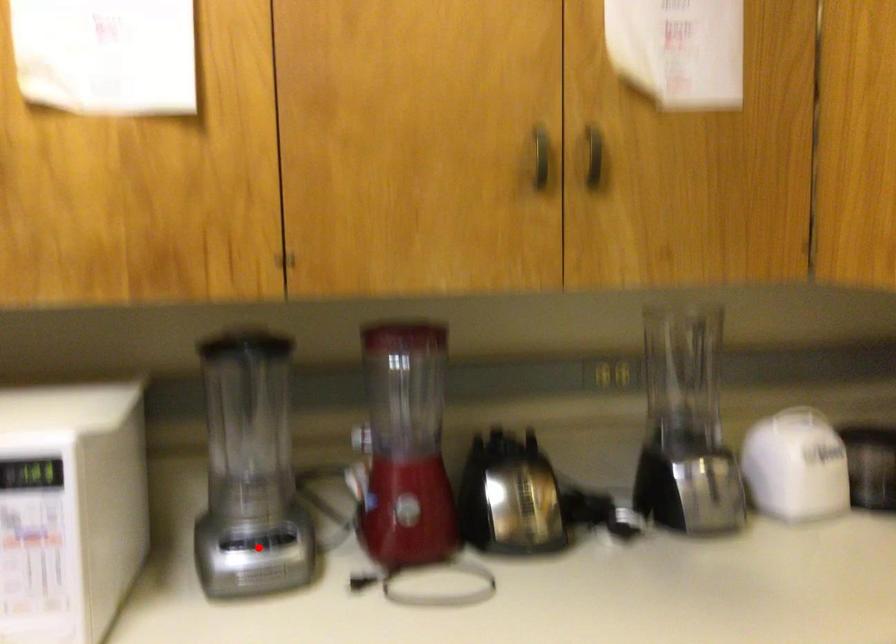
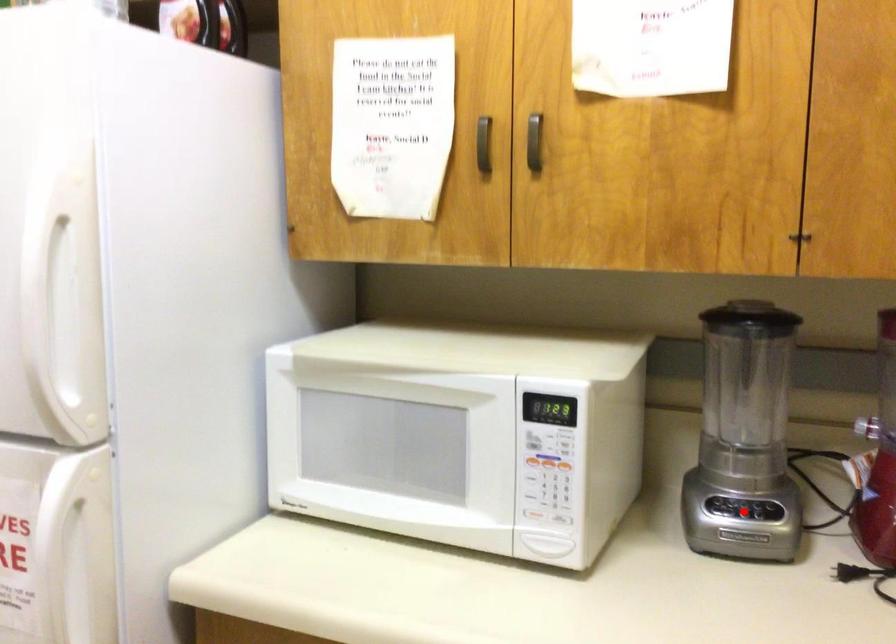
I am providing you with two images of the same scene from different viewpoints. A red point is marked on the first image and another point is marked on the second image. Are the points marked in image1 and image2 representing the same 3D position?

Yes